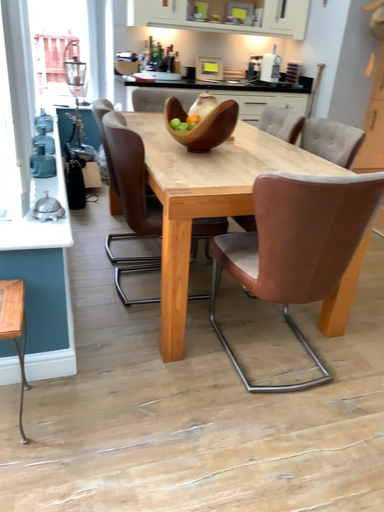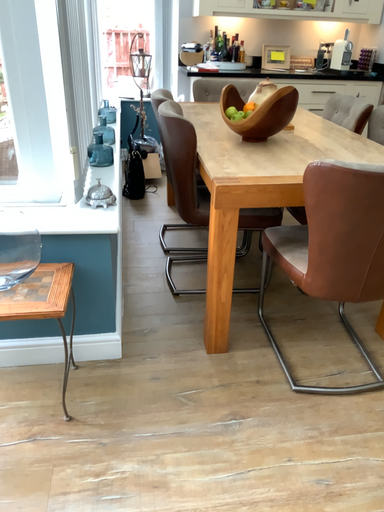
Question: How did the camera likely rotate when shooting the video?

Choices:
 (A) rotated right
 (B) rotated left

Answer: (B)